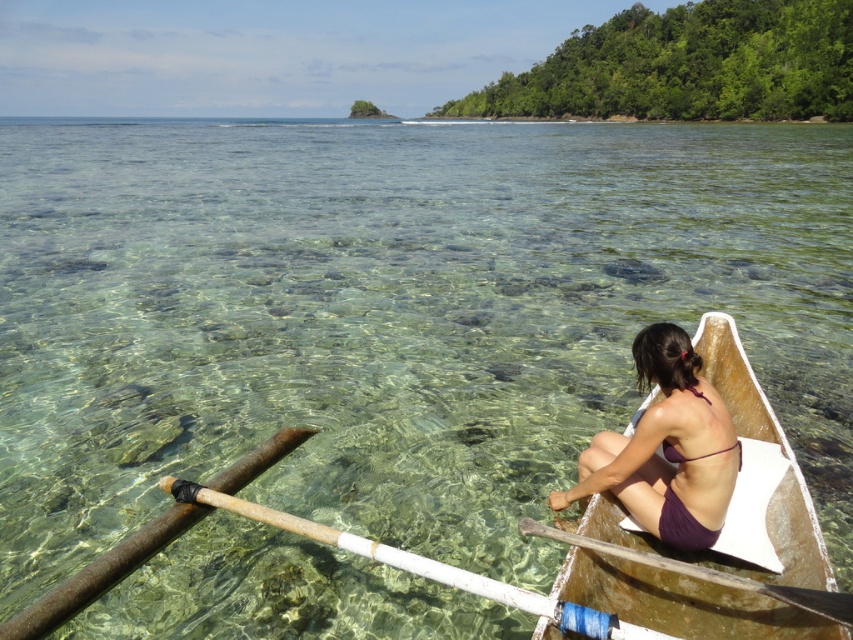
Question: From the image, what is the correct spatial relationship of wooden paddle at lower center in relation to wooden paddle at lower right?

Choices:
 (A) left
 (B) right

Answer: (A)

Question: Can you confirm if wooden canoe at right is positioned below wooden paddle at lower center?

Choices:
 (A) no
 (B) yes

Answer: (A)

Question: Which of the following is the farthest from the observer?

Choices:
 (A) wooden paddle at lower right
 (B) wooden canoe at right
 (C) purple bikini at center
 (D) wooden paddle at lower center

Answer: (C)

Question: Which point is closer to the camera?

Choices:
 (A) (848, 621)
 (B) (643, 406)
 (C) (659, 403)

Answer: (A)

Question: Does purple bikini at center appear under wooden paddle at lower center?

Choices:
 (A) no
 (B) yes

Answer: (A)

Question: Considering the real-world distances, which object is farthest from the wooden paddle at lower right?

Choices:
 (A) purple bikini at center
 (B) wooden canoe at right

Answer: (B)